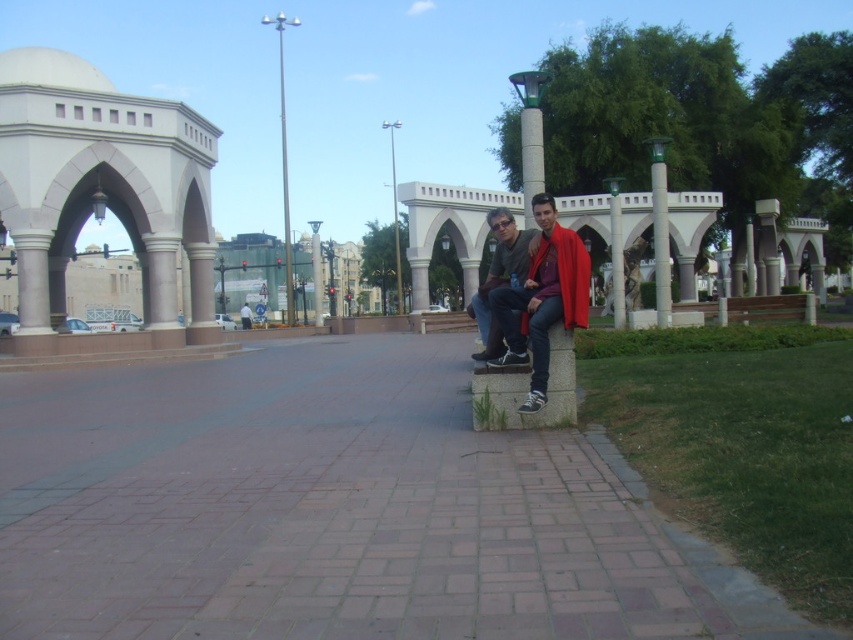
This screenshot has width=853, height=640. Describe the element at coordinates (335, 509) in the screenshot. I see `brick pavement at center` at that location.

Does point (276, 396) lie behind point (476, 294)?

Yes.

Is point (190, 456) positioned before point (492, 324)?

Yes, point (190, 456) is closer to viewer.

The image size is (853, 640). Find the location of `brick pavement at center`. brick pavement at center is located at coordinates (335, 509).

Can you confirm if brick pavement at center is thinner than red fabric cape at center?

No.

Can you confirm if brick pavement at center is smaller than red fabric cape at center?

Actually, brick pavement at center might be larger than red fabric cape at center.

Which is in front, point (241, 602) or point (532, 243)?

Point (241, 602) is more forward.

Locate an element on the screen. brick pavement at center is located at coordinates (335, 509).

Is red fabric cape at center to the right of matte black jacket at center from the viewer's perspective?

In fact, red fabric cape at center is to the left of matte black jacket at center.

Between red fabric cape at center and matte black jacket at center, which one has more height?

Standing taller between the two is matte black jacket at center.

Who is more forward, (x=531, y=260) or (x=517, y=276)?

Point (x=531, y=260) is in front.

The width and height of the screenshot is (853, 640). What are the coordinates of `red fabric cape at center` in the screenshot? It's located at (543, 298).